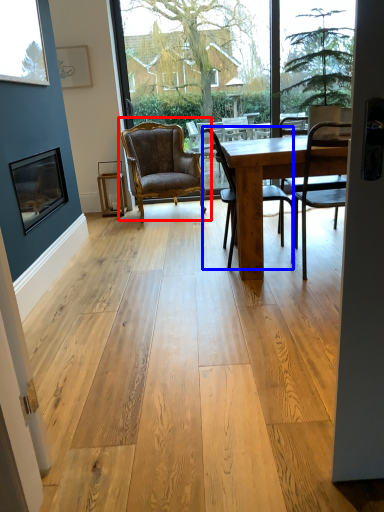
Question: Which point is closer to the camera, chair (highlighted by a red box) or chair (highlighted by a blue box)?

Choices:
 (A) chair
 (B) chair

Answer: (B)